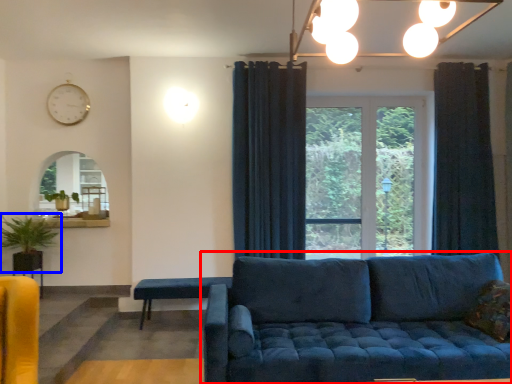
Question: Which object is closer to the camera taking this photo, studio couch (highlighted by a red box) or houseplant (highlighted by a blue box)?

Choices:
 (A) studio couch
 (B) houseplant

Answer: (A)